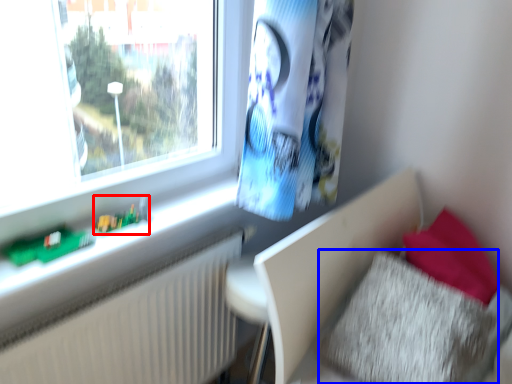
Question: Which object appears farthest to the camera in this image, toy (highlighted by a red box) or pillow (highlighted by a blue box)?

Choices:
 (A) toy
 (B) pillow

Answer: (A)